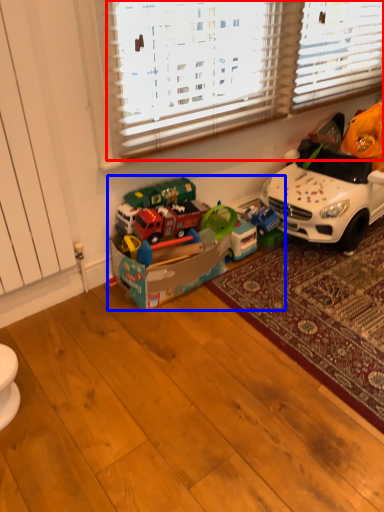
Question: Which object is closer to the camera taking this photo, blind (highlighted by a red box) or toy (highlighted by a blue box)?

Choices:
 (A) blind
 (B) toy

Answer: (A)